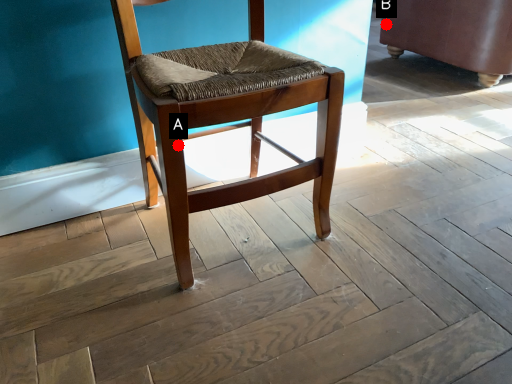
Question: Two points are circled on the image, labeled by A and B beside each circle. Which of the following is the closest to the observer?

Choices:
 (A) A is closer
 (B) B is closer

Answer: (A)